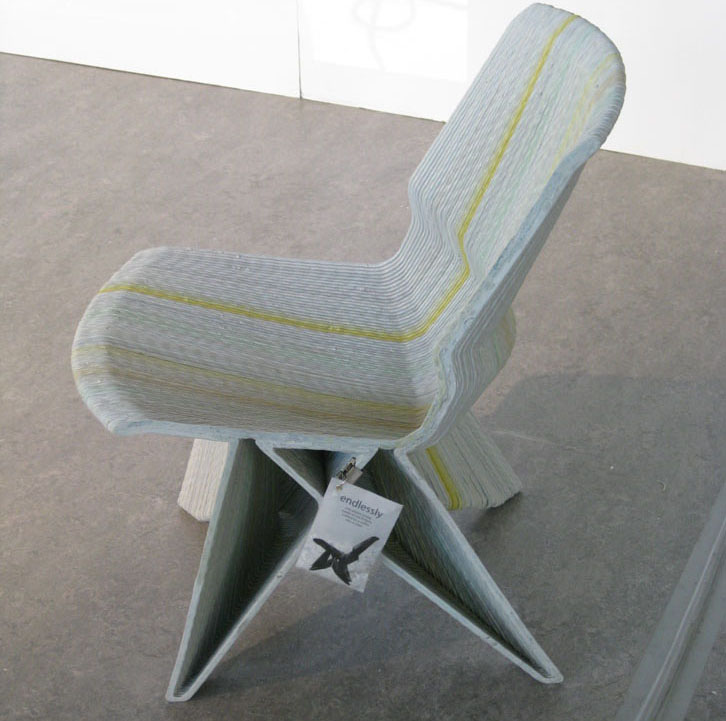
The width and height of the screenshot is (726, 721). I want to click on stone floor, so click(83, 525).